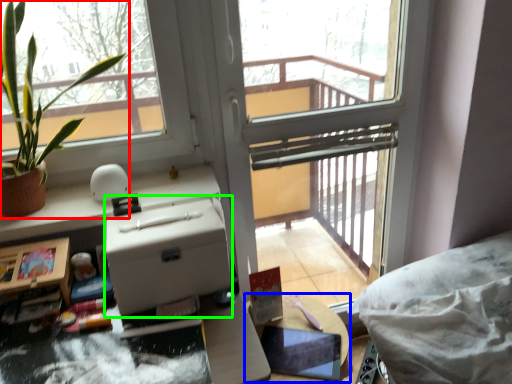
Question: Considering the real-world distances, which object is farthest from houseplant (highlighted by a red box)? table (highlighted by a blue box) or cardboard box (highlighted by a green box)?

Choices:
 (A) table
 (B) cardboard box

Answer: (A)